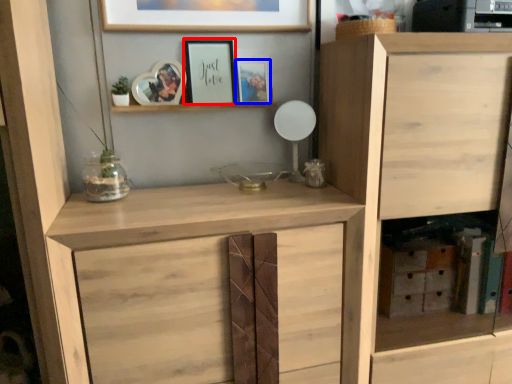
Question: Which object appears closest to the camera in this image, picture frame (highlighted by a red box) or picture frame (highlighted by a blue box)?

Choices:
 (A) picture frame
 (B) picture frame

Answer: (A)